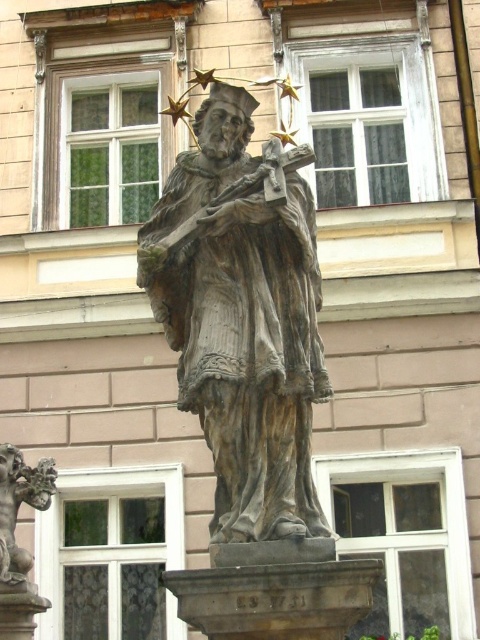
You are standing in front of a building and see the wooden statue at center and the bronze statue at lower left. Which statue is positioned more to the right side?

The wooden statue at center is positioned more to the right side than the bronze statue at lower left.

You are standing in front of the religious statue area. You see a wooden statue at center and a bronze statue at lower left. Which statue is closer to you?

The wooden statue at center is closer to you because it is in front of the bronze statue at lower left.

You are standing in front of a building with a statue. The statue is at the center. Where exactly is the wooden statue at center located in terms of coordinates?

The wooden statue at center is located at point coordinates of (242,316).